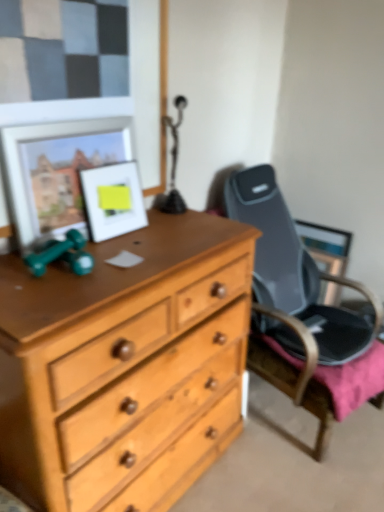
Question: Relative to matte white picture frame at upper left, which is the second picture frame in left-to-right order, is matte silver picture frame at upper left, the second picture frame when ordered from right to left, in front or behind?

Choices:
 (A) behind
 (B) front

Answer: (B)

Question: In terms of size, does matte silver picture frame at upper left, which is the 1th picture frame in left-to-right order, appear bigger or smaller than matte white picture frame at upper left, which is the second picture frame in left-to-right order?

Choices:
 (A) big
 (B) small

Answer: (A)

Question: From their relative heights in the image, would you say matte silver picture frame at upper left, which is the 1th picture frame in left-to-right order, is taller or shorter than matte white picture frame at upper left, marked as the 1th picture frame in a right-to-left arrangement?

Choices:
 (A) tall
 (B) short

Answer: (A)

Question: Considering the positions of point click(x=92, y=178) and point click(x=91, y=144), is point click(x=92, y=178) closer or farther from the camera than point click(x=91, y=144)?

Choices:
 (A) farther
 (B) closer

Answer: (A)

Question: In terms of size, does matte white picture frame at upper left, marked as the 1th picture frame in a right-to-left arrangement, appear bigger or smaller than matte silver picture frame at upper left, the second picture frame when ordered from right to left?

Choices:
 (A) small
 (B) big

Answer: (A)

Question: Is matte white picture frame at upper left, marked as the 1th picture frame in a right-to-left arrangement, in front of or behind matte silver picture frame at upper left, the second picture frame when ordered from right to left, in the image?

Choices:
 (A) behind
 (B) front

Answer: (A)

Question: From their relative heights in the image, would you say matte white picture frame at upper left, which is the second picture frame in left-to-right order, is taller or shorter than matte silver picture frame at upper left, which is the 1th picture frame in left-to-right order?

Choices:
 (A) tall
 (B) short

Answer: (B)